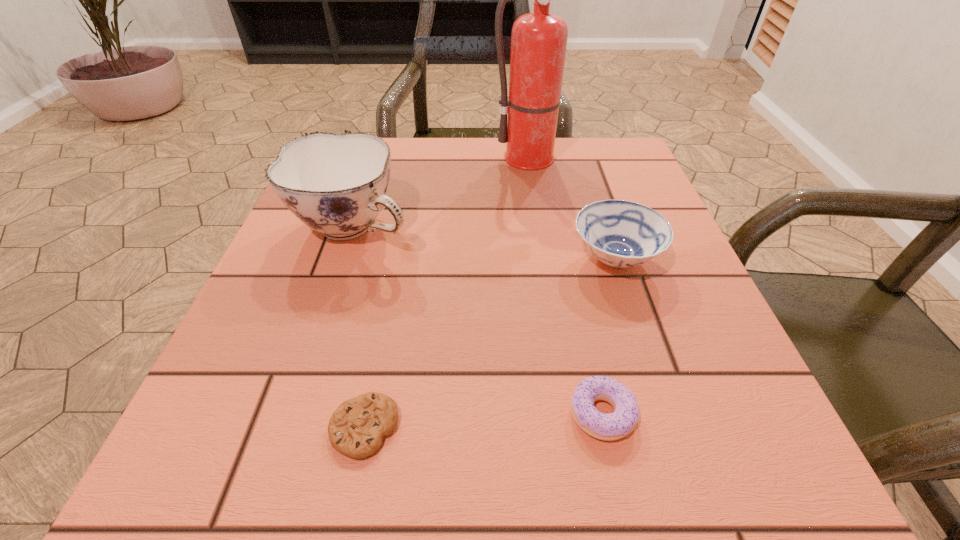
Find the location of a particular element. Image resolution: width=960 pixels, height=540 pixels. free point between the tallest object and the cookie is located at coordinates (450, 293).

Where is `free space that is in between the farthest object and the second shortest object`? free space that is in between the farthest object and the second shortest object is located at coordinates (569, 286).

I want to click on free spot between the farthest object and the third shortest object, so click(x=576, y=208).

Identify which object is located as the fourth nearest to the cookie. Please provide its 2D coordinates. Your answer should be formatted as a tuple, i.e. [(x, y)], where the tuple contains the x and y coordinates of a point satisfying the conditions above.

[(539, 39)]

Identify which object is the closest to the cookie. Please provide its 2D coordinates. Your answer should be formatted as a tuple, i.e. [(x, y)], where the tuple contains the x and y coordinates of a point satisfying the conditions above.

[(608, 427)]

This screenshot has width=960, height=540. Find the location of `vacant region that satisfies the following two spatial constraints: 1. with the handle and hose on the tallest object; 2. on the right side of the fourth tallest object`. vacant region that satisfies the following two spatial constraints: 1. with the handle and hose on the tallest object; 2. on the right side of the fourth tallest object is located at coordinates (584, 414).